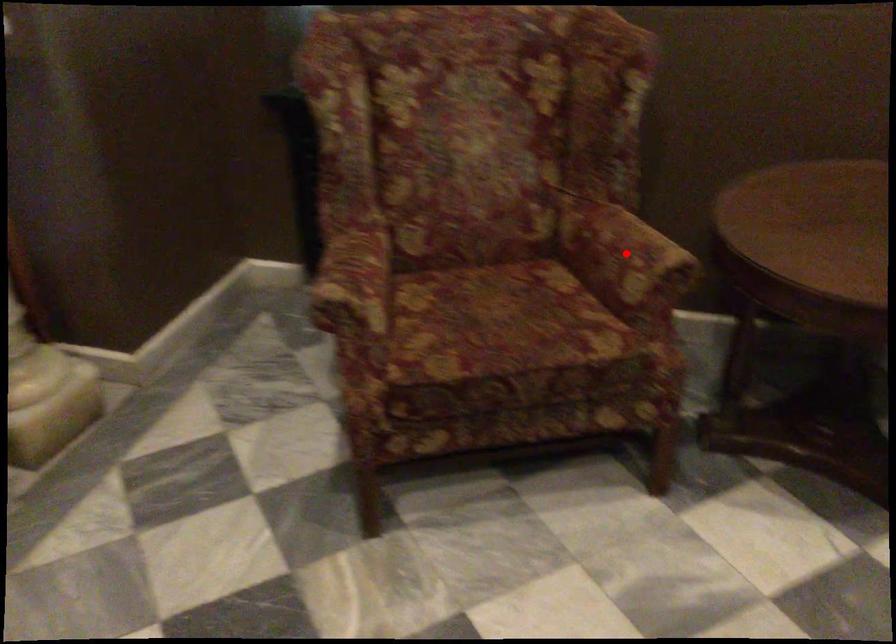
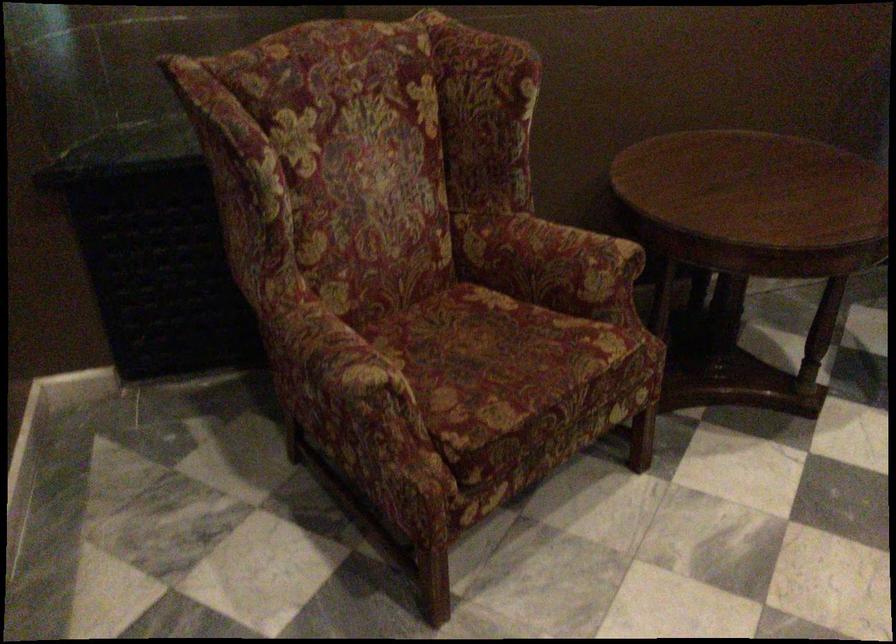
In the second image, find the point that corresponds to the highlighted location in the first image.

(572, 256)